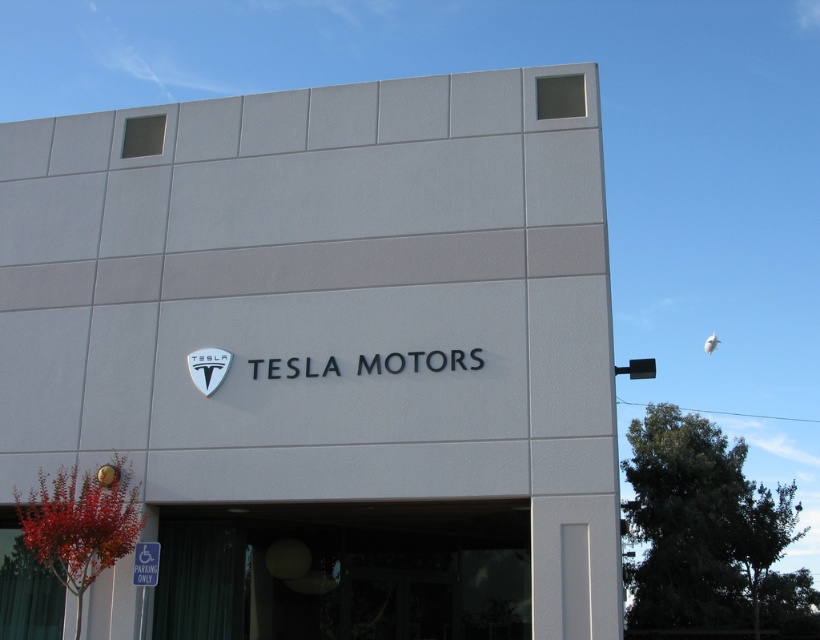
Who is positioned more to the right, white matte sign at center or transparent glass door at lower center?

From the viewer's perspective, transparent glass door at lower center appears more on the right side.

In the scene shown: How far apart are white matte sign at center and transparent glass door at lower center?

white matte sign at center is 6.97 meters away from transparent glass door at lower center.

Where is `white matte sign at center`? The height and width of the screenshot is (640, 820). white matte sign at center is located at coordinates (328, 349).